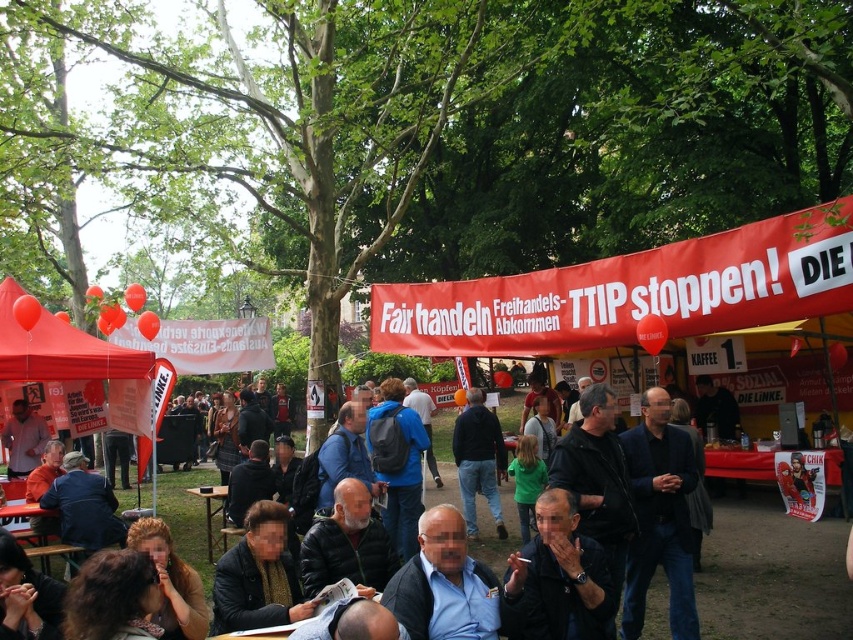
Question: Is dark blue suit at center closer to camera compared to matte red canopy at left?

Choices:
 (A) yes
 (B) no

Answer: (A)

Question: Which of the following is the closest to the observer?

Choices:
 (A) matte red canopy at left
 (B) dark blue suit at center

Answer: (B)

Question: Does dark blue suit at center have a lesser width compared to matte red canopy at left?

Choices:
 (A) no
 (B) yes

Answer: (B)

Question: Does dark blue suit at center appear under matte red canopy at left?

Choices:
 (A) yes
 (B) no

Answer: (A)

Question: Which of the following is the farthest from the observer?

Choices:
 (A) (117, 369)
 (B) (439, 602)

Answer: (A)

Question: Among these objects, which one is farthest from the camera?

Choices:
 (A) matte red canopy at left
 (B) dark blue suit at center

Answer: (A)